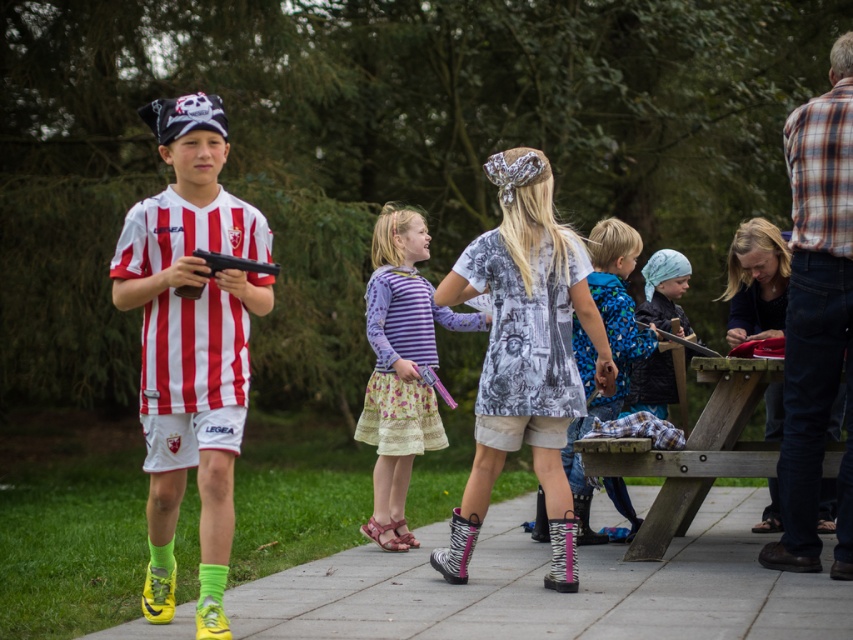
Is point (206, 232) in front of point (612, 225)?

Yes, point (206, 232) is in front of point (612, 225).

Is matte red and white jersey at center in front of printed fabric dress at center?

Yes, matte red and white jersey at center is in front of printed fabric dress at center.

Locate an element on the screen. matte red and white jersey at center is located at coordinates (190, 342).

Does concrete pavement at center appear over printed fabric dress at center?

Incorrect, concrete pavement at center is not positioned above printed fabric dress at center.

Does concrete pavement at center appear on the left side of printed fabric dress at center?

Yes, concrete pavement at center is to the left of printed fabric dress at center.

Describe the element at coordinates (550, 589) in the screenshot. The height and width of the screenshot is (640, 853). I see `concrete pavement at center` at that location.

You are a GUI agent. You are given a task and a screenshot of the screen. Output one action in this format:
    pyautogui.click(x=<x>, y=<y>)
    Task: Click on the concrete pavement at center
    This screenshot has height=640, width=853.
    Given the screenshot: What is the action you would take?
    pyautogui.click(x=550, y=589)

Can you confirm if wooden picnic table at lower right is wider than matte black gun at center?

Correct, the width of wooden picnic table at lower right exceeds that of matte black gun at center.

Between point (664, 531) and point (270, 269), which one is positioned in front?

Point (270, 269) is more forward.

Locate an element on the screen. The height and width of the screenshot is (640, 853). wooden picnic table at lower right is located at coordinates (694, 451).

You are a GUI agent. You are given a task and a screenshot of the screen. Output one action in this format:
    pyautogui.click(x=<x>, y=<y>)
    Task: Click on the wooden picnic table at lower right
    
    Given the screenshot: What is the action you would take?
    pyautogui.click(x=694, y=451)